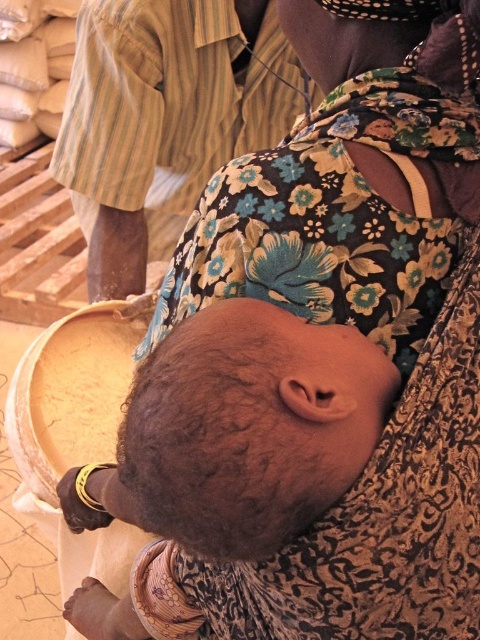
Question: Observing the image, what is the correct spatial positioning of dark brown hair at center in reference to striped cotton shirt at upper left?

Choices:
 (A) right
 (B) left

Answer: (A)

Question: Which of the following is the farthest from the observer?

Choices:
 (A) dark brown hair at center
 (B) striped cotton shirt at upper left

Answer: (B)

Question: Can you confirm if dark brown hair at center is positioned to the left of striped cotton shirt at upper left?

Choices:
 (A) yes
 (B) no

Answer: (B)

Question: Can you confirm if dark brown hair at center is positioned below striped cotton shirt at upper left?

Choices:
 (A) no
 (B) yes

Answer: (B)

Question: Among these points, which one is farthest from the camera?

Choices:
 (A) [289, 512]
 (B) [176, 202]

Answer: (B)